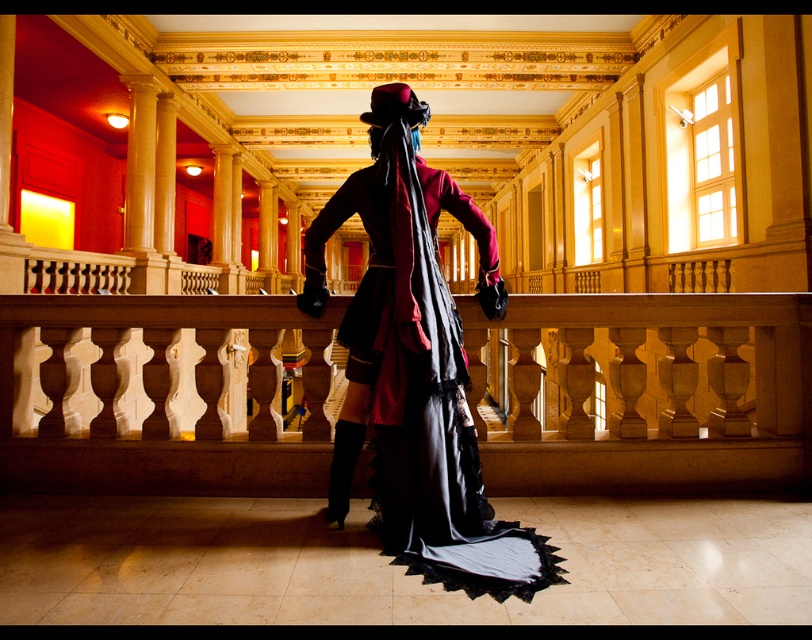
Question: Does wooden balustrade at center appear on the right side of velvet maroon coat at center?

Choices:
 (A) yes
 (B) no

Answer: (A)

Question: Is wooden balustrade at center to the right of velvet maroon coat at center from the viewer's perspective?

Choices:
 (A) yes
 (B) no

Answer: (A)

Question: Which point is closer to the camera?

Choices:
 (A) (369, 204)
 (B) (767, 362)

Answer: (A)

Question: Can you confirm if wooden balustrade at center is positioned below velvet maroon coat at center?

Choices:
 (A) yes
 (B) no

Answer: (A)